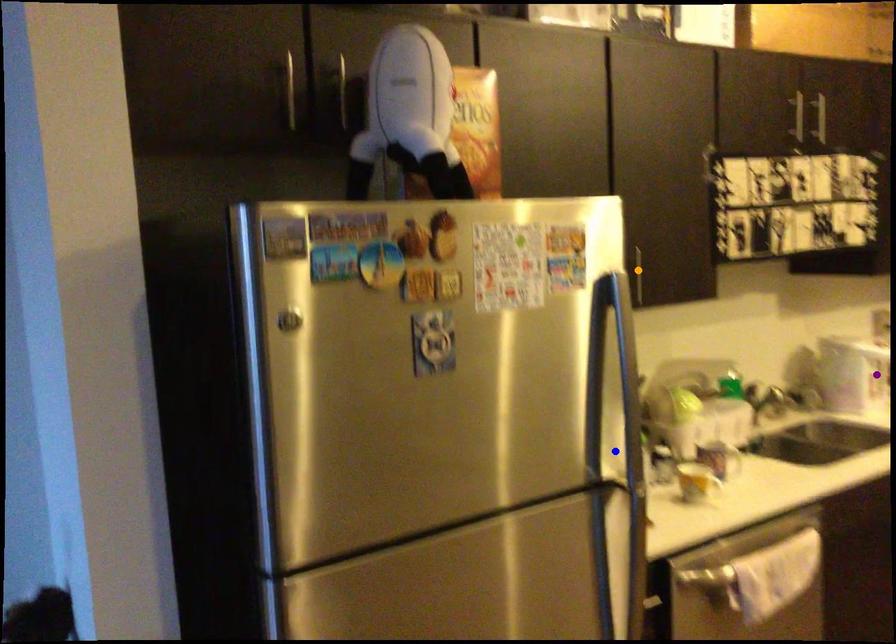
Order these from nearest to farthest:
A) blue point
B) orange point
C) purple point

1. blue point
2. orange point
3. purple point